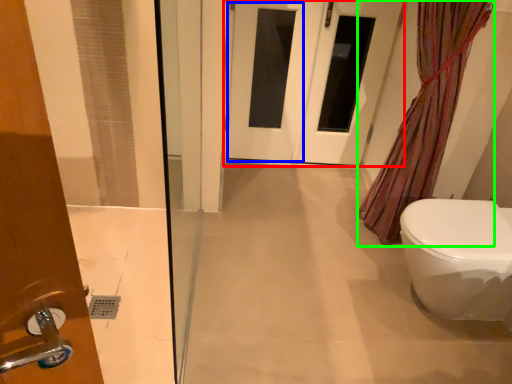
Question: Which is nearer to the door (highlighted by a red box)? screen door (highlighted by a blue box) or shower curtain (highlighted by a green box).

Choices:
 (A) screen door
 (B) shower curtain

Answer: (A)